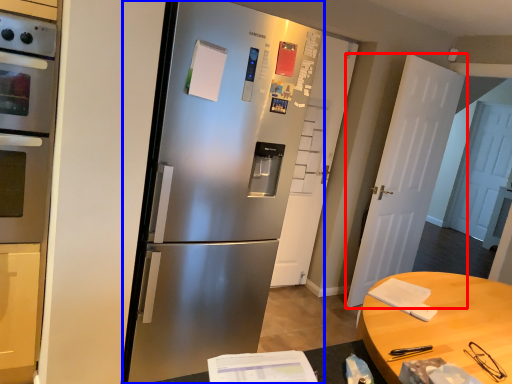
Question: Which point is further to the camera, door (highlighted by a red box) or refrigerator (highlighted by a blue box)?

Choices:
 (A) door
 (B) refrigerator

Answer: (A)